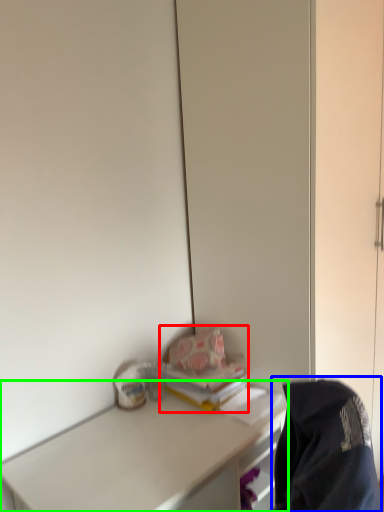
Question: Which object is the farthest from book (highlighted by a red box)? Choose among these: jacket (highlighted by a blue box) or desk (highlighted by a green box).

Choices:
 (A) jacket
 (B) desk

Answer: (A)